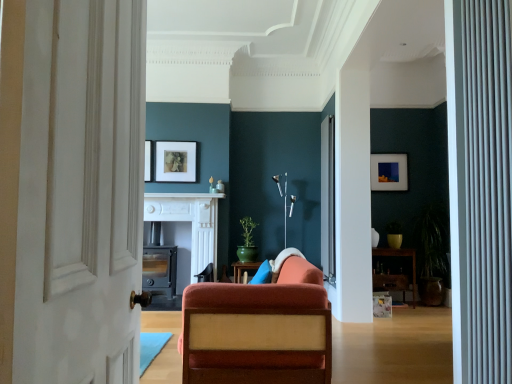
Question: Does matte gray fireplace at center, arranged as the 2th fireplace when viewed from the left, have a lesser width compared to wooden shelf at right?

Choices:
 (A) yes
 (B) no

Answer: (B)

Question: Is matte gray fireplace at center, placed as the first fireplace when sorted from right to left, not inside wooden shelf at right?

Choices:
 (A) yes
 (B) no

Answer: (A)

Question: From a real-world perspective, is matte gray fireplace at center, placed as the first fireplace when sorted from right to left, physically above wooden shelf at right?

Choices:
 (A) yes
 (B) no

Answer: (A)

Question: Is matte gray fireplace at center, placed as the first fireplace when sorted from right to left, surrounding wooden shelf at right?

Choices:
 (A) yes
 (B) no

Answer: (B)

Question: Does matte gray fireplace at center, arranged as the 2th fireplace when viewed from the left, turn towards wooden shelf at right?

Choices:
 (A) no
 (B) yes

Answer: (A)

Question: Is matte gray fireplace at center, arranged as the 2th fireplace when viewed from the left, wider than wooden shelf at right?

Choices:
 (A) no
 (B) yes

Answer: (B)

Question: Does matte blue picture frame at upper right, which appears as the second picture frame when viewed from the left, contain velvet orange chair at center?

Choices:
 (A) yes
 (B) no

Answer: (B)

Question: Is matte blue picture frame at upper right, which is counted as the second picture frame, starting from the front, at the right side of velvet orange chair at center?

Choices:
 (A) no
 (B) yes

Answer: (B)

Question: Is matte blue picture frame at upper right, the first picture frame when ordered from back to front, positioned with its back to velvet orange chair at center?

Choices:
 (A) yes
 (B) no

Answer: (B)

Question: Is matte blue picture frame at upper right, which appears as the second picture frame when viewed from the left, bigger than velvet orange chair at center?

Choices:
 (A) no
 (B) yes

Answer: (A)

Question: Is matte blue picture frame at upper right, which is counted as the second picture frame, starting from the front, to the left of velvet orange chair at center from the viewer's perspective?

Choices:
 (A) no
 (B) yes

Answer: (A)

Question: From the image's perspective, would you say matte blue picture frame at upper right, which is counted as the second picture frame, starting from the front, is positioned over velvet orange chair at center?

Choices:
 (A) no
 (B) yes

Answer: (B)

Question: From a real-world perspective, is white marble fireplace at center positioned under white textured door at left based on gravity?

Choices:
 (A) no
 (B) yes

Answer: (A)